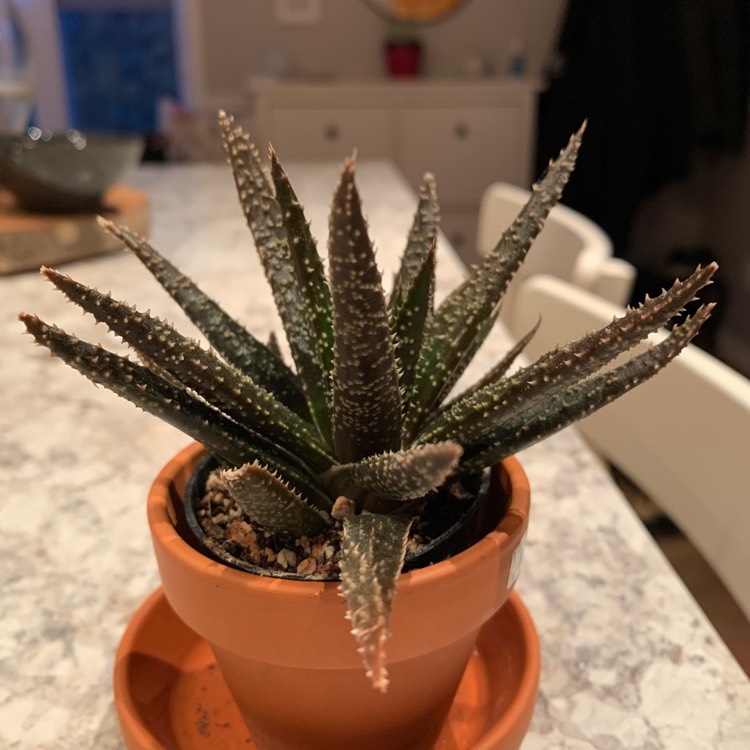
Locate an element on the screen. drawer pulls is located at coordinates (336, 133), (464, 128), (459, 238).